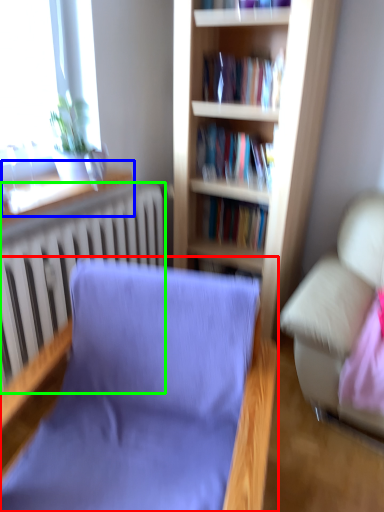
Question: Which object is the farthest from chair (highlighted by a red box)? Choose among these: window sill (highlighted by a blue box) or radiator (highlighted by a green box).

Choices:
 (A) window sill
 (B) radiator

Answer: (A)